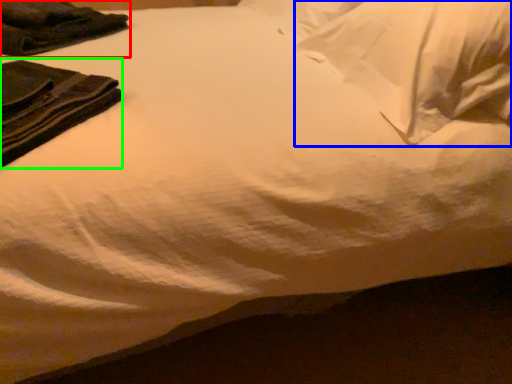
Question: Considering the real-world distances, which object is closest to clothing (highlighted by a red box)? pillow (highlighted by a blue box) or clothing (highlighted by a green box).

Choices:
 (A) pillow
 (B) clothing

Answer: (B)